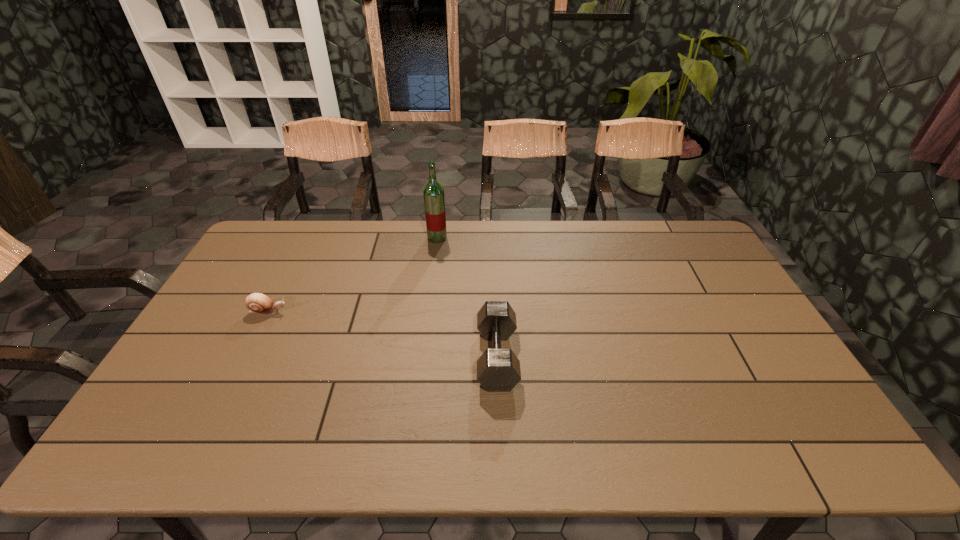
Where is `object that is at the left edge`? This screenshot has height=540, width=960. object that is at the left edge is located at coordinates (258, 303).

Locate an element on the screen. vacant space at the far edge of the desktop is located at coordinates click(610, 231).

In order to click on vacant area at the near edge in this screenshot , I will do `click(309, 441)`.

You are a GUI agent. You are given a task and a screenshot of the screen. Output one action in this format:
    pyautogui.click(x=<x>, y=<y>)
    Task: Click on the vacant space at the left edge
    The width and height of the screenshot is (960, 540).
    Given the screenshot: What is the action you would take?
    pyautogui.click(x=152, y=413)

Identify the location of free space between the tallest object and the leftmost object. (352, 275).

This screenshot has width=960, height=540. In order to click on vacant point located between the second tallest object and the leftmost object in this screenshot , I will do `click(383, 334)`.

Find the location of `vacant area that lies between the shortest object and the dumbbell`. vacant area that lies between the shortest object and the dumbbell is located at coordinates (383, 334).

I want to click on vacant space that's between the liquor and the rightmost object, so click(468, 298).

Image resolution: width=960 pixels, height=540 pixels. Find the location of `vacant area that lies between the escargot and the second shortest object`. vacant area that lies between the escargot and the second shortest object is located at coordinates (383, 334).

Locate an element on the screen. The height and width of the screenshot is (540, 960). vacant area between the rightmost object and the liquor is located at coordinates (468, 298).